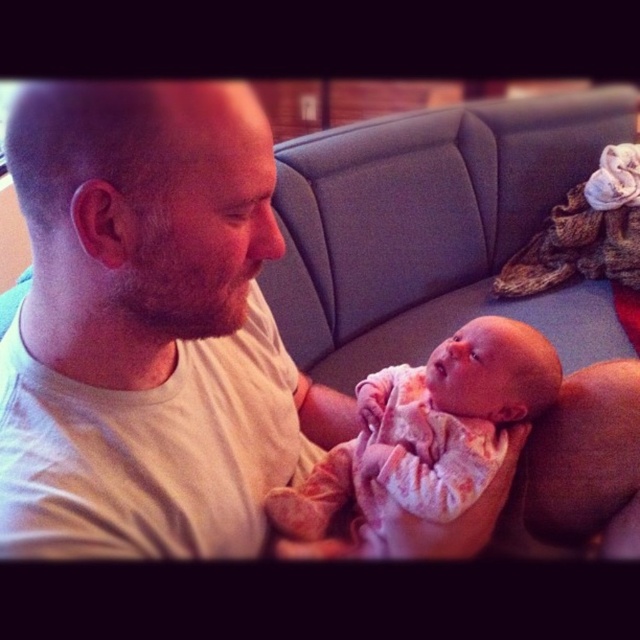
Between white matte t-shirt at center and floral pink fabric baby at center, which one appears on the left side from the viewer's perspective?

Positioned to the left is white matte t-shirt at center.

Does point (147, 99) come closer to viewer compared to point (424, 451)?

Yes, it is.

Identify the location of white matte t-shirt at center. (147, 326).